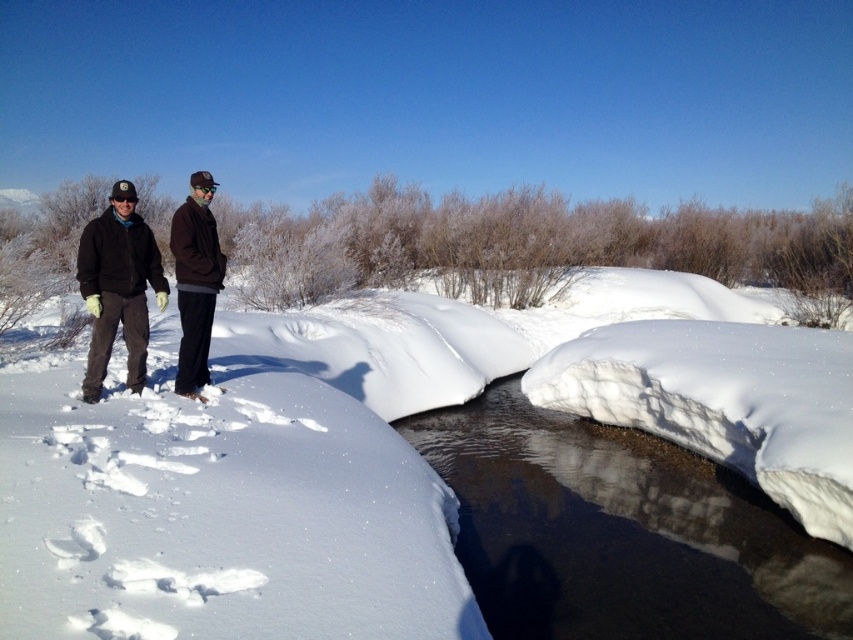
Based on the photo, you are a photographer trying to capture a clear shot of the dark brown jacket at center without the white ice stream at center blocking it. How should you adjust your position?

Move forward closer to the dark brown jacket at center so that it comes forward relative to the white ice stream at center, allowing you to frame the jacket without the stream obstructing the view.

You are an observer standing in the winter scene. You notice the white fluffy snow at center and the dark brown jacket at left. Which object is taller?

The white fluffy snow at center is taller than the dark brown jacket at left according to the description.